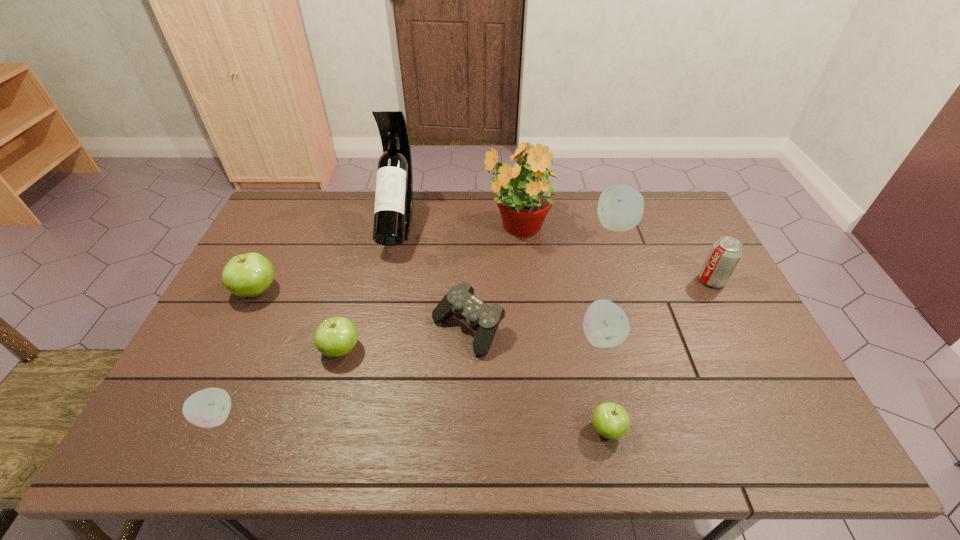
Locate an element on the screen. This screenshot has height=540, width=960. object located at the right edge is located at coordinates (725, 253).

Image resolution: width=960 pixels, height=540 pixels. In order to click on object at the near left corner in this screenshot , I will do `click(208, 408)`.

Locate an element on the screen. The width and height of the screenshot is (960, 540). vacant space at the far edge of the desktop is located at coordinates (339, 204).

The width and height of the screenshot is (960, 540). I want to click on free space at the near edge, so click(x=486, y=424).

In the image, there is a desktop. Find the location of `vacant space at the left edge`. vacant space at the left edge is located at coordinates (302, 240).

Where is `vacant space at the right edge of the desktop`? vacant space at the right edge of the desktop is located at coordinates (664, 241).

In the image, there is a desktop. At what (x,y) coordinates should I click in order to perform the action: click on vacant area at the near left corner. Please return your answer as a coordinate pair (x, y). Looking at the image, I should click on (149, 433).

Identify the location of free space between the wine bottle and the second green apple from right to left. The image size is (960, 540). (370, 286).

Where is `vacant region between the nearest white apple and the nearest green apple`? This screenshot has width=960, height=540. vacant region between the nearest white apple and the nearest green apple is located at coordinates (411, 423).

The image size is (960, 540). Identify the location of blank region between the wine bottle and the soda can. (555, 252).